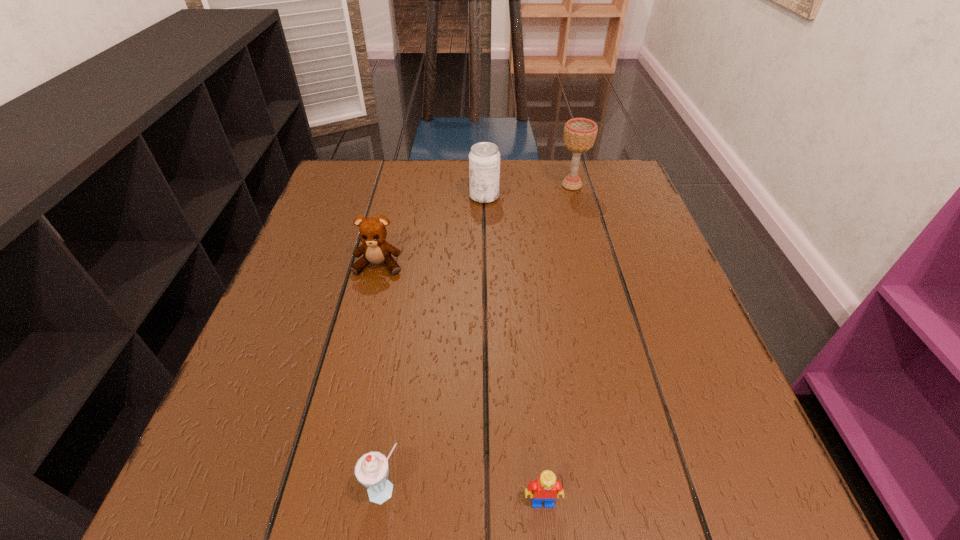
At what (x,y) coordinates should I click in order to perform the action: click on vacant space in between the fourth object from right to left and the tallest object. Please return your answer as a coordinate pair (x, y). The width and height of the screenshot is (960, 540). Looking at the image, I should click on (479, 338).

Locate an element on the screen. vacant space that is in between the milkshake and the Lego is located at coordinates (464, 496).

Where is `free space between the second object from left to right and the rightmost object`? free space between the second object from left to right and the rightmost object is located at coordinates (479, 338).

Find the location of `object that stands as the second closest to the soda can`. object that stands as the second closest to the soda can is located at coordinates (375, 250).

Locate an element on the screen. Image resolution: width=960 pixels, height=540 pixels. object that can be found as the closest to the fourth object from right to left is located at coordinates pos(546,488).